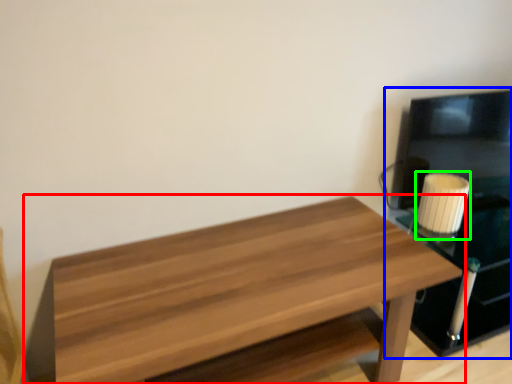
Question: Which is nearer to the table (highlighted by a red box)? entertainment center (highlighted by a blue box) or candle holder (highlighted by a green box).

Choices:
 (A) entertainment center
 (B) candle holder

Answer: (B)